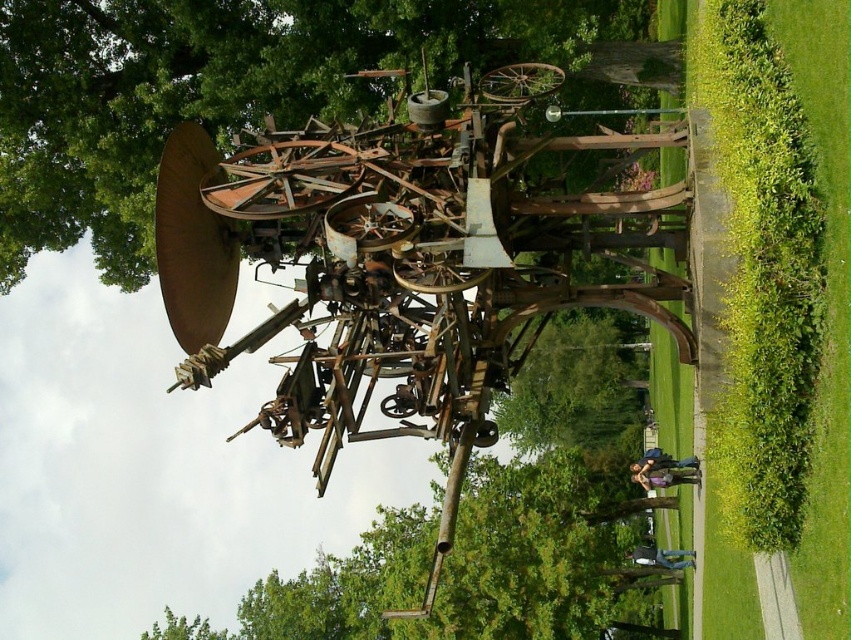
Question: Which of the following is the farthest from the observer?

Choices:
 (A) rusty metal sculpture at center
 (B) green leafy tree at center

Answer: (B)

Question: In this image, where is rusty metal sculpture at center located relative to green leafy tree at center?

Choices:
 (A) below
 (B) above

Answer: (B)

Question: Can you confirm if rusty metal sculpture at center is wider than green leafy tree at center?

Choices:
 (A) no
 (B) yes

Answer: (A)

Question: Which of the following is the closest to the observer?

Choices:
 (A) rusty metal sculpture at center
 (B) green leafy tree at center

Answer: (A)

Question: Is rusty metal sculpture at center behind green leafy tree at center?

Choices:
 (A) yes
 (B) no

Answer: (B)